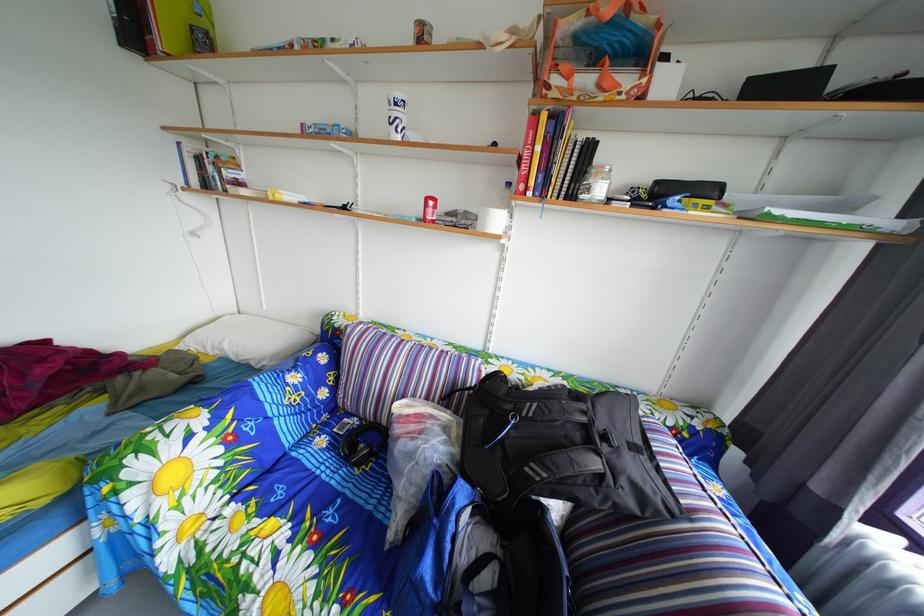
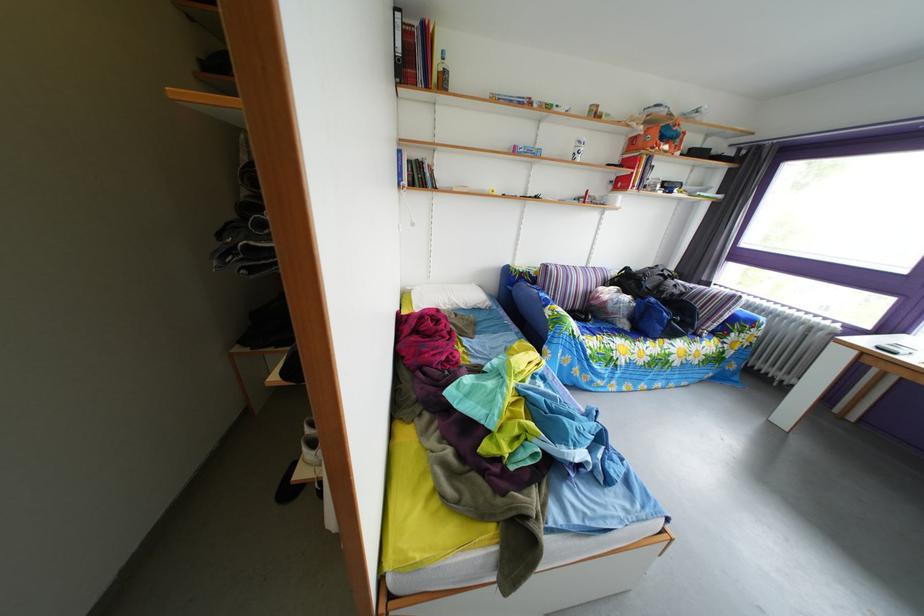
Locate, in the second image, the point that corresponds to the point at 604,70 in the first image.

(673, 147)